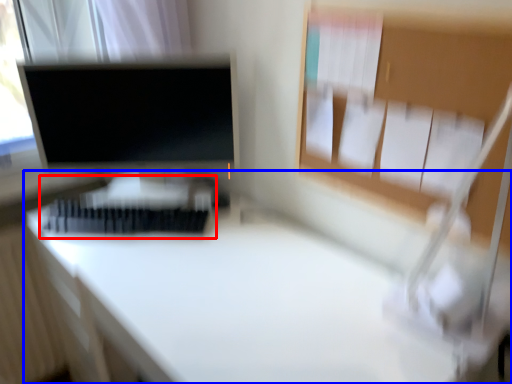
Question: Which object is closer to the camera taking this photo, bed (highlighted by a red box) or desk (highlighted by a blue box)?

Choices:
 (A) bed
 (B) desk

Answer: (B)